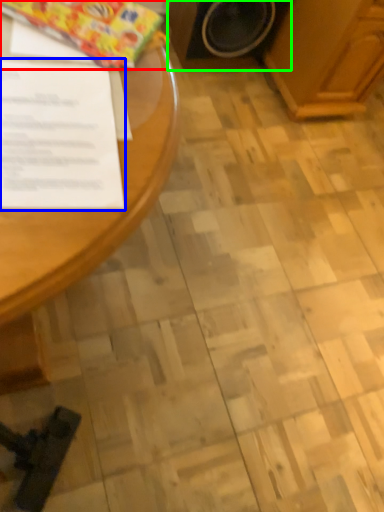
Question: Based on their relative distances, which object is nearer to wrapping paper (highlighted by a red box)? Choose from document (highlighted by a blue box) and appliance (highlighted by a green box).

Choices:
 (A) document
 (B) appliance

Answer: (A)